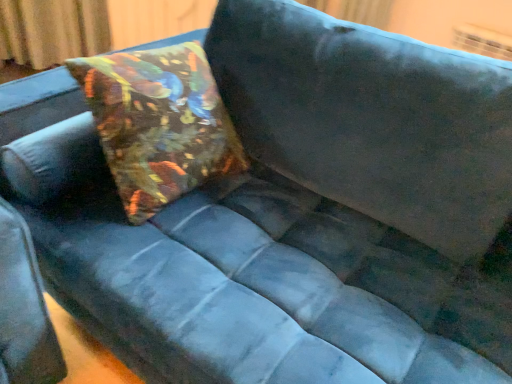
What do you see at coordinates (159, 123) in the screenshot?
I see `multicolored fabric pillow at upper left` at bounding box center [159, 123].

Where is `multicolored fabric pillow at upper left`? multicolored fabric pillow at upper left is located at coordinates (159, 123).

What is the approximate width of multicolored fabric pillow at upper left?

12.43 inches.

Identify the location of multicolored fabric pillow at upper left. (159, 123).